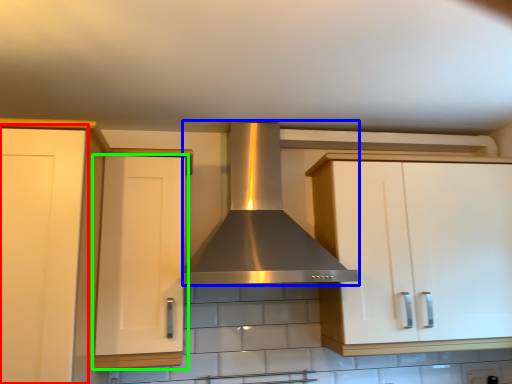
Question: Based on their relative distances, which object is farther from cabinetry (highlighted by a red box)? Choose from home appliance (highlighted by a blue box) and cabinetry (highlighted by a green box).

Choices:
 (A) home appliance
 (B) cabinetry

Answer: (A)